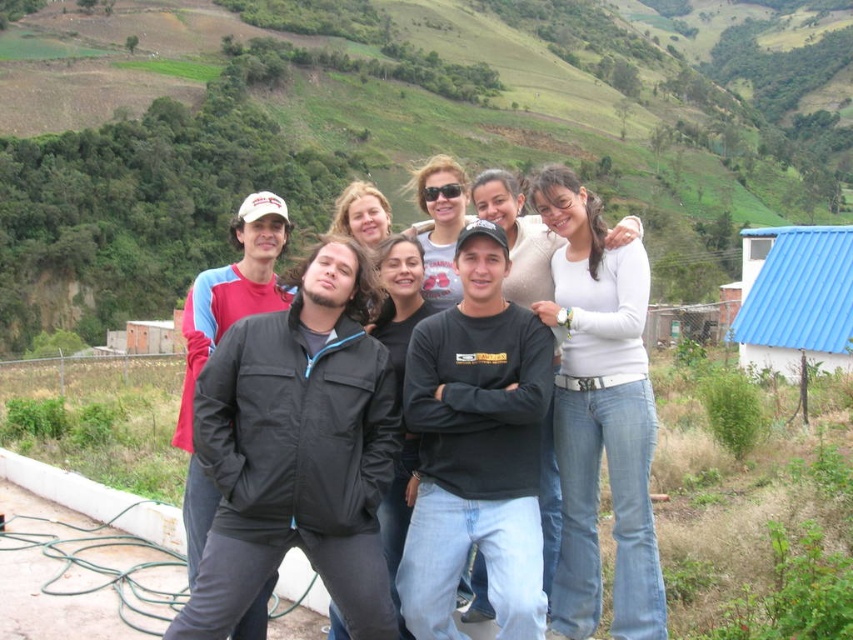
You are standing in the middle of the group of eight people in the rural setting. Looking at the point marked by coordinates [397,125], which object in the scene does this point correspond to?

The point marked by coordinates [397,125] corresponds to the green grassy hillside at upper center.

You are a photographer trying to capture a wide shot of the group. Considering the green grassy hillside at upper center and the white matte shirt at center, which object would require a wider angle lens to include fully in the frame?

The green grassy hillside at upper center would require a wider angle lens because its width is larger than the white matte shirt at center.